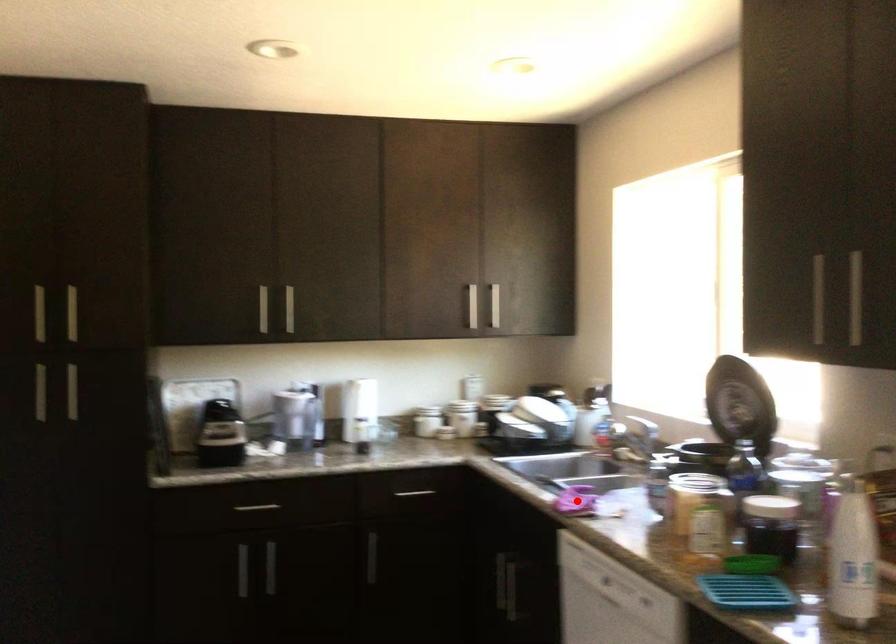
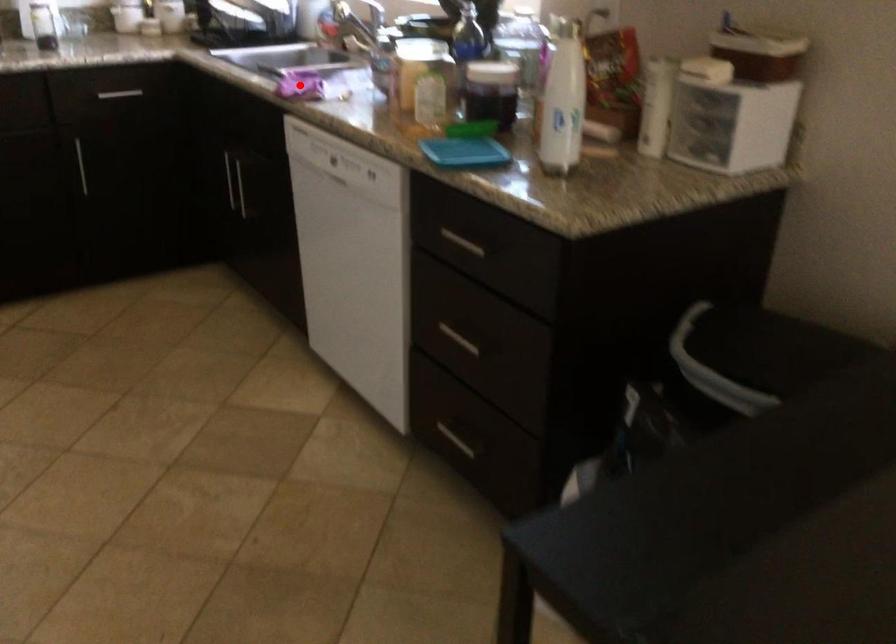
I am providing you with two images of the same scene from different viewpoints. A red point is marked on the first image and another point is marked on the second image. Do the highlighted points in image1 and image2 indicate the same real-world spot?

Yes